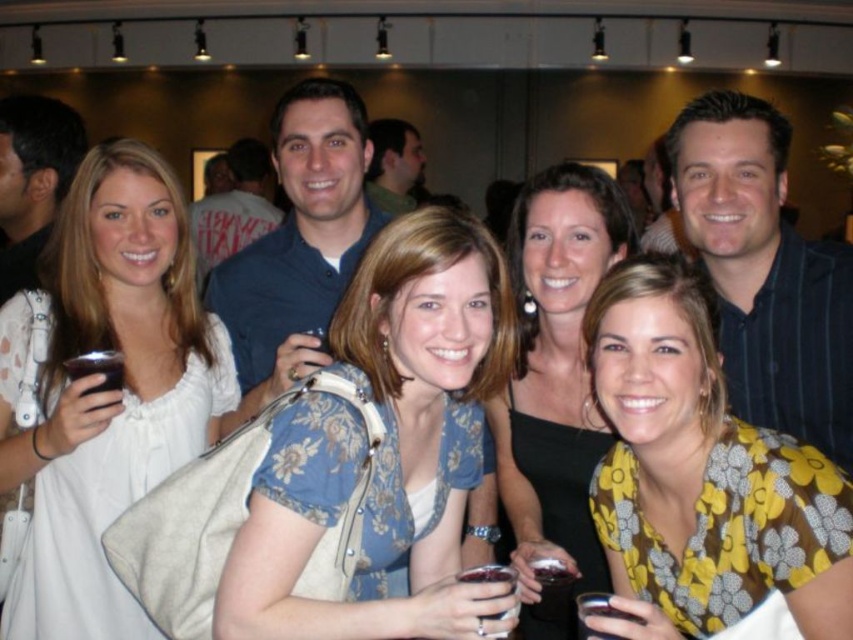
Question: Which of the following is the farthest from the observer?

Choices:
 (A) translucent glass wine at lower center
 (B) transparent plastic wine glass at lower right
 (C) yellow floral blouse at center
 (D) matte plastic cup at lower left

Answer: (A)

Question: Does yellow floral blouse at center appear on the right side of black fabric dress at center?

Choices:
 (A) no
 (B) yes

Answer: (B)

Question: Among these points, which one is nearest to the camera?

Choices:
 (A) coord(579,173)
 (B) coord(592,632)
 (C) coord(505,577)

Answer: (B)

Question: Where is matte plastic cup at lower left located in relation to transparent plastic wine glass at lower center in the image?

Choices:
 (A) above
 (B) below

Answer: (A)

Question: Does translucent glass wine at lower center lie in front of matte plastic cup at lower left?

Choices:
 (A) yes
 (B) no

Answer: (B)

Question: Which of the following is the farthest from the observer?

Choices:
 (A) black fabric dress at center
 (B) translucent glass wine at lower center
 (C) floral fabric dress at center

Answer: (B)